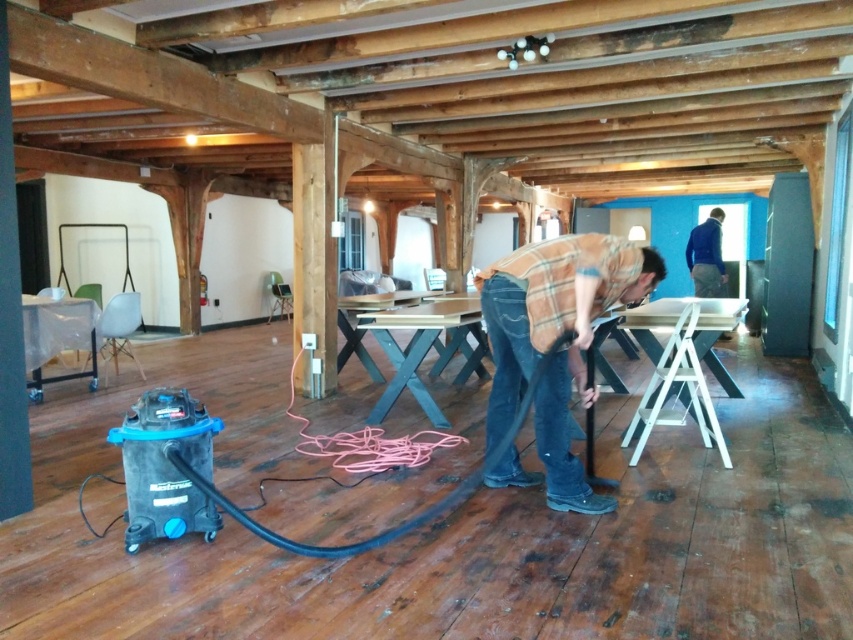
You are a guest in this room and want to locate both the brown plaid shirt at center and the dark blue sweater at upper right. Which one is positioned higher up in the image?

The dark blue sweater at upper right is positioned higher up in the image than the brown plaid shirt at center.

You are a delivery person who needs to place a package between the brown plaid shirt at center and the dark blue sweater at upper right. The package requires a minimum of 6 meters of space. Is there enough space between them?

The brown plaid shirt at center and dark blue sweater at upper right are 5.50 meters apart from each other, which is less than the required 6 meters. Therefore, there isn not enough space to place the package between them.